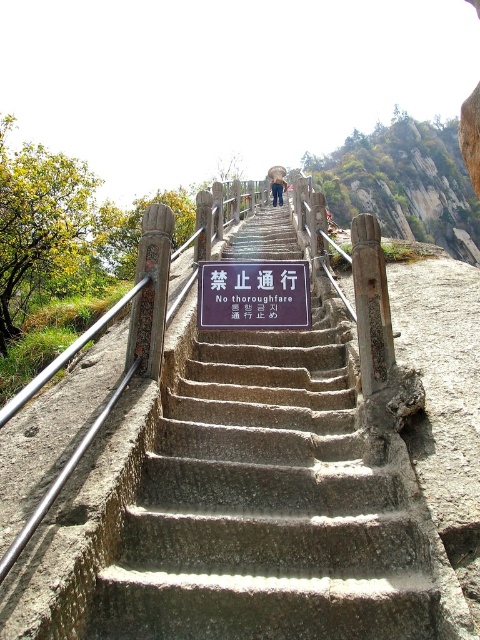
Does gray concrete stairs at center appear on the right side of metallic rectangular sign at center?

Yes, gray concrete stairs at center is to the right of metallic rectangular sign at center.

Who is more distant from viewer, (167, 410) or (201, 307)?

The point (201, 307) is behind.

Where is `gray concrete stairs at center`? This screenshot has width=480, height=640. gray concrete stairs at center is located at coordinates (266, 506).

Identify the location of gray concrete stairs at center. (266, 506).

Between point (197, 289) and point (272, 188), which one is positioned in front?

Point (197, 289) is more forward.

Does metallic rectangular sign at center appear under blue denim jeans at center?

Correct, metallic rectangular sign at center is located below blue denim jeans at center.

Does point (247, 317) come behind point (280, 179)?

No, (247, 317) is closer to viewer.

This screenshot has height=640, width=480. I want to click on metallic rectangular sign at center, so click(253, 296).

The image size is (480, 640). What do you see at coordinates (266, 506) in the screenshot? I see `gray concrete stairs at center` at bounding box center [266, 506].

Does point (259, 614) come closer to viewer compared to point (284, 179)?

That is True.

Who is more forward, (244, 550) or (277, 198)?

Point (244, 550) is more forward.

I want to click on gray concrete stairs at center, so click(x=266, y=506).